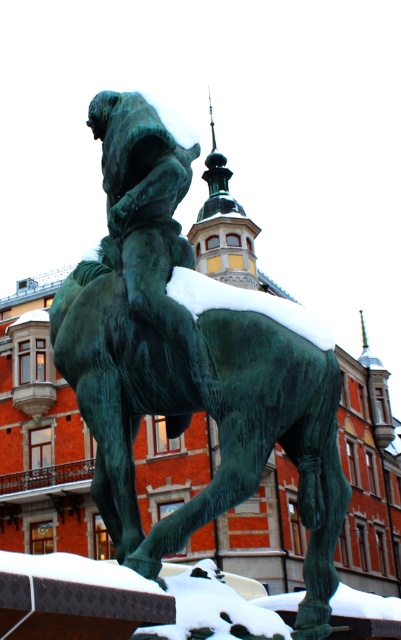
You are a maintenance worker who needs to clean the red brick building in the background. You have a ladder that can reach 10 meters. The green patinated bronze horse at center is in your way. Can you safely move the ladder around the horse to reach the building?

The distance between the green patinated bronze horse at center and the red brick building is 12.74 meters. Since the ladder can only reach 10 meters, you cannot safely move the ladder around the horse to reach the building.

Based on the photo, you are an art conservator assessing the bronze statue of a horse and rider in the image. You need to determine the spatial relationship between the green patinated bronze horse at center and the green patinated bronze statue at center. Which one is wider?

The green patinated bronze horse at center is wider than the green patinated bronze statue at center.